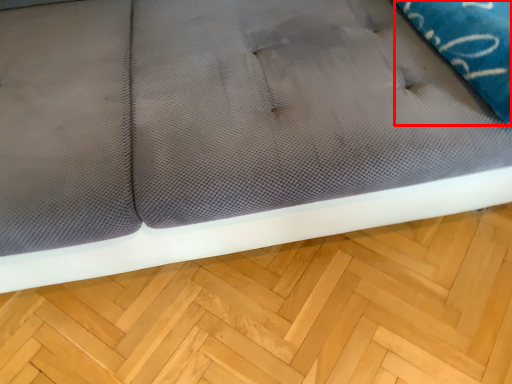
Question: From the image's perspective, what is the correct spatial relationship of pillow (annotated by the red box) in relation to hardwood?

Choices:
 (A) above
 (B) below

Answer: (A)